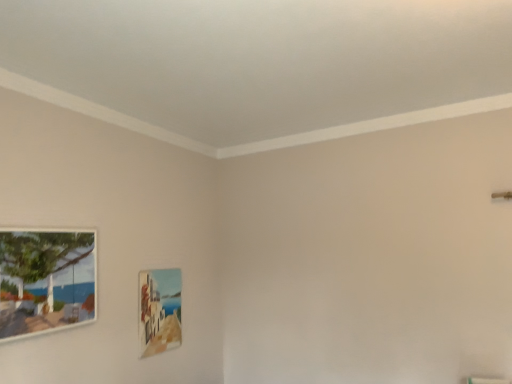
How much space does wooden picture frame at left, the first picture frame when ordered from left to right, occupy horizontally?

wooden picture frame at left, the first picture frame when ordered from left to right, is 1.71 inches in width.

What do you see at coordinates (46, 280) in the screenshot? I see `wooden picture frame at left, the 1th picture frame positioned from the front` at bounding box center [46, 280].

Locate an element on the screen. The height and width of the screenshot is (384, 512). wooden picture frame at left, the first picture frame when ordered from left to right is located at coordinates (46, 280).

How much space does matte wooden picture frame at lower center, the first picture frame positioned from the right, occupy vertically?

The height of matte wooden picture frame at lower center, the first picture frame positioned from the right, is 56.93 centimeters.

Find the location of a particular element. matte wooden picture frame at lower center, arranged as the second picture frame when viewed from the front is located at coordinates (159, 310).

Describe the element at coordinates (159, 310) in the screenshot. I see `matte wooden picture frame at lower center, the first picture frame from the back` at that location.

Locate an element on the screen. Image resolution: width=512 pixels, height=384 pixels. wooden picture frame at left, the 1th picture frame positioned from the front is located at coordinates (46, 280).

Which is more to the right, matte wooden picture frame at lower center, arranged as the second picture frame when viewed from the front, or wooden picture frame at left, the first picture frame when ordered from left to right?

matte wooden picture frame at lower center, arranged as the second picture frame when viewed from the front.

In the image, is matte wooden picture frame at lower center, arranged as the second picture frame when viewed from the front, positioned in front of or behind wooden picture frame at left, the first picture frame when ordered from left to right?

matte wooden picture frame at lower center, arranged as the second picture frame when viewed from the front, is positioned farther from the viewer than wooden picture frame at left, the first picture frame when ordered from left to right.

Between point (148, 350) and point (5, 295), which one is positioned behind?

The point (148, 350) is behind.

From the image's perspective, which one is positioned lower, matte wooden picture frame at lower center, arranged as the second picture frame when viewed from the front, or wooden picture frame at left, the 2th picture frame from the right?

matte wooden picture frame at lower center, arranged as the second picture frame when viewed from the front, is shown below in the image.

From a real-world perspective, who is located higher, matte wooden picture frame at lower center, the first picture frame positioned from the right, or wooden picture frame at left, the 1th picture frame positioned from the front?

wooden picture frame at left, the 1th picture frame positioned from the front, from a real-world perspective.

Considering the relative sizes of matte wooden picture frame at lower center, arranged as the second picture frame when viewed from the front, and wooden picture frame at left, the first picture frame when ordered from left to right, in the image provided, is matte wooden picture frame at lower center, arranged as the second picture frame when viewed from the front, thinner than wooden picture frame at left, the first picture frame when ordered from left to right,?

Correct, the width of matte wooden picture frame at lower center, arranged as the second picture frame when viewed from the front, is less than that of wooden picture frame at left, the first picture frame when ordered from left to right.

Which of these two, matte wooden picture frame at lower center, the first picture frame from the back, or wooden picture frame at left, the first picture frame when ordered from left to right, stands shorter?

Standing shorter between the two is wooden picture frame at left, the first picture frame when ordered from left to right.

Considering the relative sizes of matte wooden picture frame at lower center, the first picture frame from the back, and wooden picture frame at left, acting as the second picture frame starting from the back, in the image provided, is matte wooden picture frame at lower center, the first picture frame from the back, bigger than wooden picture frame at left, acting as the second picture frame starting from the back,?

No.

Is matte wooden picture frame at lower center, arranged as the second picture frame when viewed from the front, not inside wooden picture frame at left, the first picture frame when ordered from left to right?

Yes.

Is matte wooden picture frame at lower center, which is the 2th picture frame in left-to-right order, positioned far away from wooden picture frame at left, the 2th picture frame from the right?

No, matte wooden picture frame at lower center, which is the 2th picture frame in left-to-right order, is in close proximity to wooden picture frame at left, the 2th picture frame from the right.

Is matte wooden picture frame at lower center, the first picture frame positioned from the right, turned away from wooden picture frame at left, the 2th picture frame from the right?

No, matte wooden picture frame at lower center, the first picture frame positioned from the right, is not facing away from wooden picture frame at left, the 2th picture frame from the right.

In the scene shown: How different are the orientations of matte wooden picture frame at lower center, which is the 2th picture frame in left-to-right order, and wooden picture frame at left, the first picture frame when ordered from left to right, in degrees?

0.00351 degrees separate the facing orientations of matte wooden picture frame at lower center, which is the 2th picture frame in left-to-right order, and wooden picture frame at left, the first picture frame when ordered from left to right.

Locate an element on the screen. picture frame lying below the wooden picture frame at left, the first picture frame when ordered from left to right (from the image's perspective) is located at coordinates (159, 310).

Between wooden picture frame at left, the 2th picture frame from the right, and matte wooden picture frame at lower center, the first picture frame positioned from the right, which one appears on the right side from the viewer's perspective?

Positioned to the right is matte wooden picture frame at lower center, the first picture frame positioned from the right.

Relative to matte wooden picture frame at lower center, which is the 2th picture frame in left-to-right order, is wooden picture frame at left, the first picture frame when ordered from left to right, in front or behind?

wooden picture frame at left, the first picture frame when ordered from left to right, is positioned closer to the viewer than matte wooden picture frame at lower center, which is the 2th picture frame in left-to-right order.

Considering the points (39, 247) and (139, 308), which point is behind, point (39, 247) or point (139, 308)?

The point (139, 308) is behind.

Based on the photo, from the image's perspective, which is above, wooden picture frame at left, the first picture frame when ordered from left to right, or matte wooden picture frame at lower center, which is the 2th picture frame in left-to-right order?

wooden picture frame at left, the first picture frame when ordered from left to right, appears higher in the image.

From a real-world perspective, between wooden picture frame at left, the first picture frame when ordered from left to right, and matte wooden picture frame at lower center, the first picture frame from the back, who is vertically higher?

→ From a 3D spatial view, wooden picture frame at left, the first picture frame when ordered from left to right, is above.

Does wooden picture frame at left, acting as the second picture frame starting from the back, have a lesser width compared to matte wooden picture frame at lower center, arranged as the second picture frame when viewed from the front?

Incorrect, the width of wooden picture frame at left, acting as the second picture frame starting from the back, is not less than that of matte wooden picture frame at lower center, arranged as the second picture frame when viewed from the front.

Between wooden picture frame at left, the 1th picture frame positioned from the front, and matte wooden picture frame at lower center, the first picture frame from the back, which one has more height?

matte wooden picture frame at lower center, the first picture frame from the back.

Considering the sizes of objects wooden picture frame at left, the first picture frame when ordered from left to right, and matte wooden picture frame at lower center, the first picture frame from the back, in the image provided, who is smaller, wooden picture frame at left, the first picture frame when ordered from left to right, or matte wooden picture frame at lower center, the first picture frame from the back,?

With smaller size is matte wooden picture frame at lower center, the first picture frame from the back.

Is wooden picture frame at left, the 2th picture frame from the right, not inside matte wooden picture frame at lower center, which is the 2th picture frame in left-to-right order?

Yes.

Based on the photo, does wooden picture frame at left, acting as the second picture frame starting from the back, touch matte wooden picture frame at lower center, which is the 2th picture frame in left-to-right order?

No, wooden picture frame at left, acting as the second picture frame starting from the back, is not in contact with matte wooden picture frame at lower center, which is the 2th picture frame in left-to-right order.

Is wooden picture frame at left, the 1th picture frame positioned from the front, turned away from matte wooden picture frame at lower center, the first picture frame positioned from the right?

No.

Where is `picture frame that is above the matte wooden picture frame at lower center, which is the 2th picture frame in left-to-right order (from a real-world perspective)`? This screenshot has width=512, height=384. picture frame that is above the matte wooden picture frame at lower center, which is the 2th picture frame in left-to-right order (from a real-world perspective) is located at coordinates (46, 280).

Where is `picture frame on the right of wooden picture frame at left, the first picture frame when ordered from left to right`? The height and width of the screenshot is (384, 512). picture frame on the right of wooden picture frame at left, the first picture frame when ordered from left to right is located at coordinates (159, 310).

At what (x,y) coordinates should I click in order to perform the action: click on picture frame behind the wooden picture frame at left, the 1th picture frame positioned from the front. Please return your answer as a coordinate pair (x, y). This screenshot has height=384, width=512. Looking at the image, I should click on [x=159, y=310].